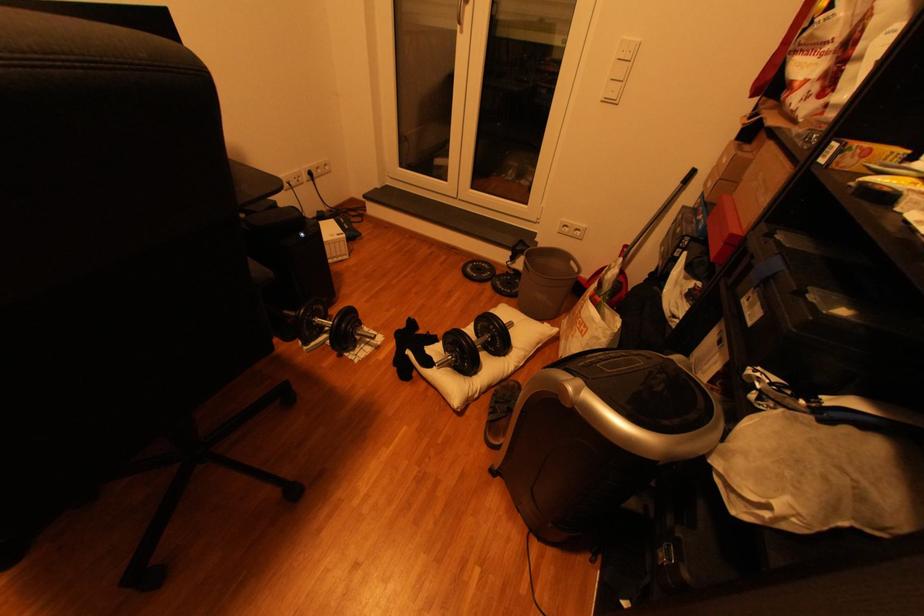
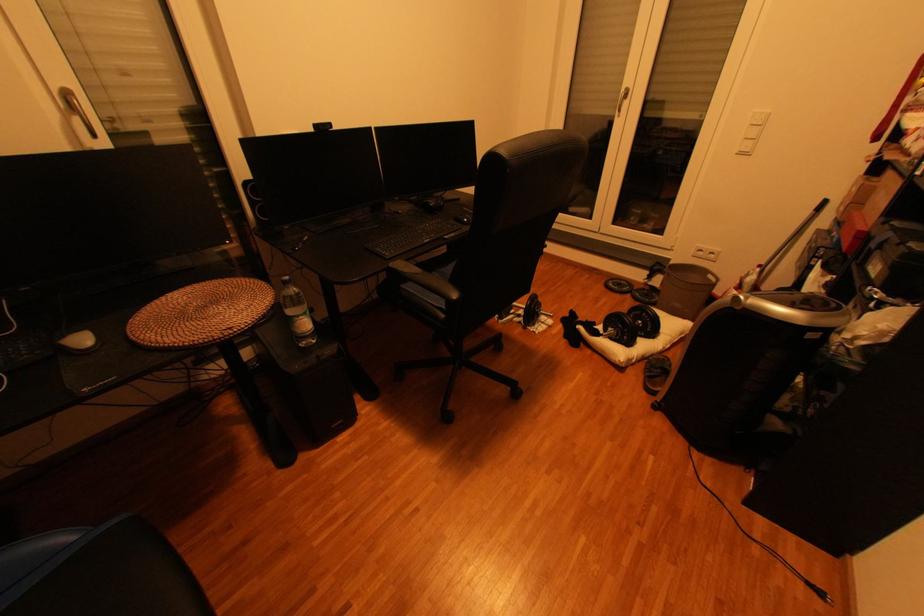
In the second image, find the point that corresponds to (614,100) in the first image.

(749, 155)